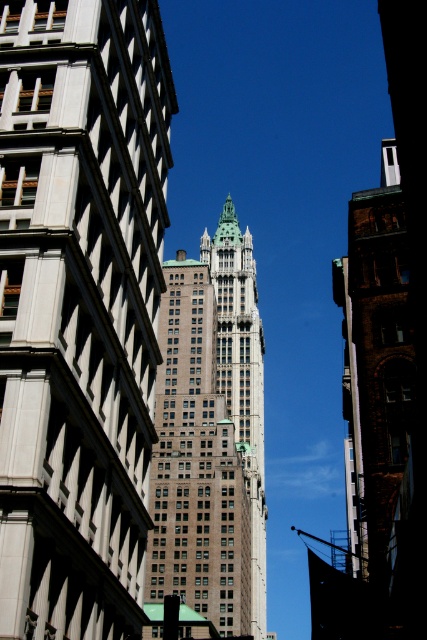
You are standing in front of the white stone skyscraper at center and the green stone tower at center. Which one is closer to you?

The white stone skyscraper at center is closer to the viewer than the green stone tower at center.

You are standing 50 meters away from the point at coordinates point (x=22, y=476). Can you walk towards it and reach it within 10 seconds if you walk at 1.5 meters per second?

The distance of point (x=22, y=476) from viewer is 38.66 meters. Since you are currently 50 meters away, you need to cover 50 meters minus 38.66 meters equals 11.34 meters. Walking at 1.5 meters per second, it would take 11.34 divided by 1.5 equals approximately 7.56 seconds. Therefore, yes, you can reach it within 10 seconds.